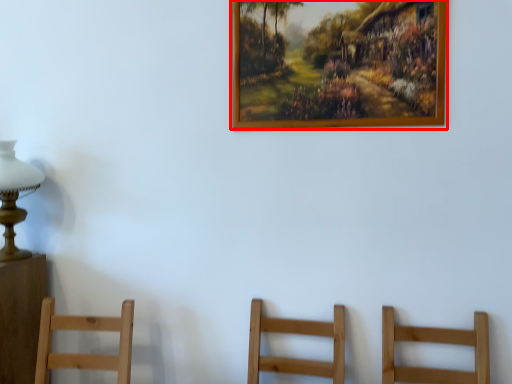
Question: Observing the image, what is the correct spatial positioning of picture frame (annotated by the red box) in reference to table lamp?

Choices:
 (A) right
 (B) left

Answer: (A)